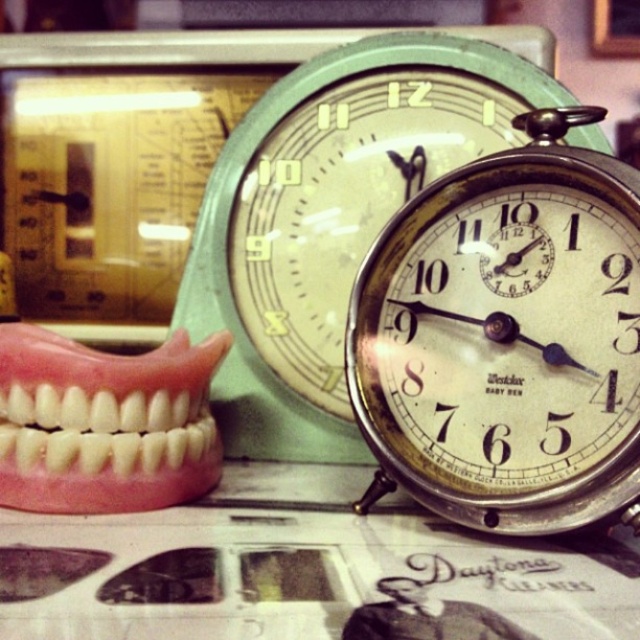
Is point (483, 276) farther from viewer compared to point (48, 401)?

That is True.

Between point (416, 353) and point (202, 426), which one is positioned in front?

Point (416, 353)

This screenshot has width=640, height=640. What are the coordinates of `metallic silver alarm clock at center` in the screenshot? It's located at (506, 339).